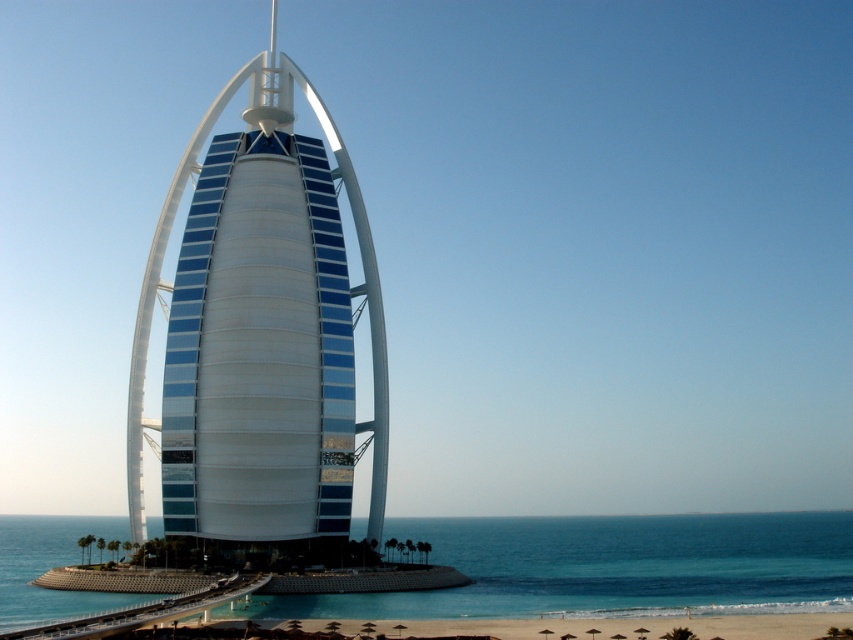
You are standing at the camera position and want to take a photo of the white glossy tower at center. If the camera has a maximum range of 100 meters, will you be able to capture the tower clearly?

The white glossy tower at center and camera are 96.58 meters apart from each other. Since the distance is within the camera maximum range of 100 meters, you can capture the tower clearly.

Consider the image. You are a tourist standing on the beach near the Burj Al Arab. You want to take a photo of the white glossy tower at center without any obstructions. Since you are standing on the clear blue water at lower center, can you move forward to get a better view?

The white glossy tower at center is located above clear blue water at lower center, so if you are standing on the clear blue water at lower center, moving forward would bring you closer to the tower, potentially offering a clearer and less obstructed view. However, ensure you are on solid ground or a designated area for safety.

You are a guest staying at the Burj Al Arab hotel and want to take a photo of the white glossy tower at center from the beach. Where should you stand relative to the clear blue water at lower center to ensure the tower is fully visible in your photo?

You should stand behind the clear blue water at lower center because the clear blue water at lower center is behind the white glossy tower at center, so positioning yourself behind the water will allow the tower to be in front and fully visible in your photo.